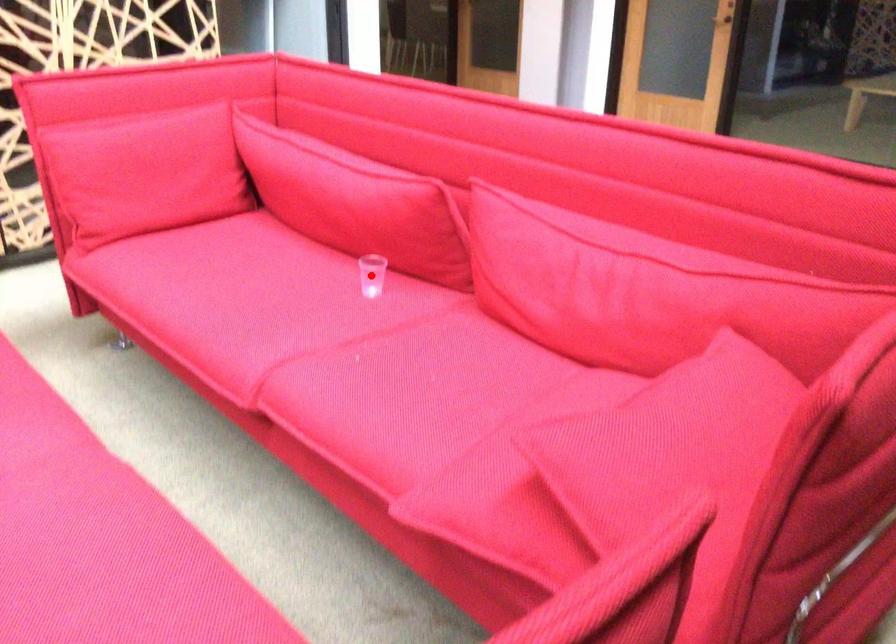
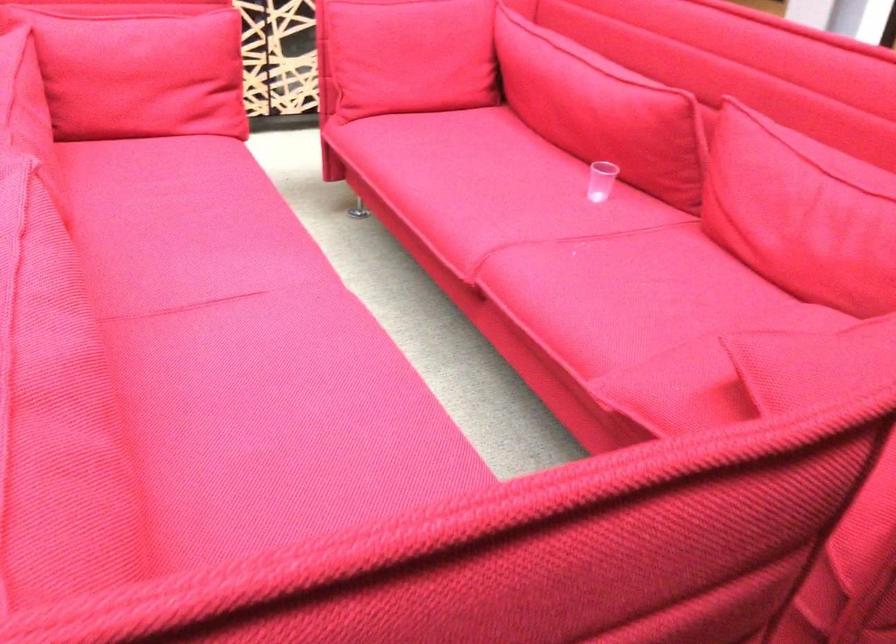
Locate, in the second image, the point that corresponds to the highlighted location in the first image.

(600, 180)